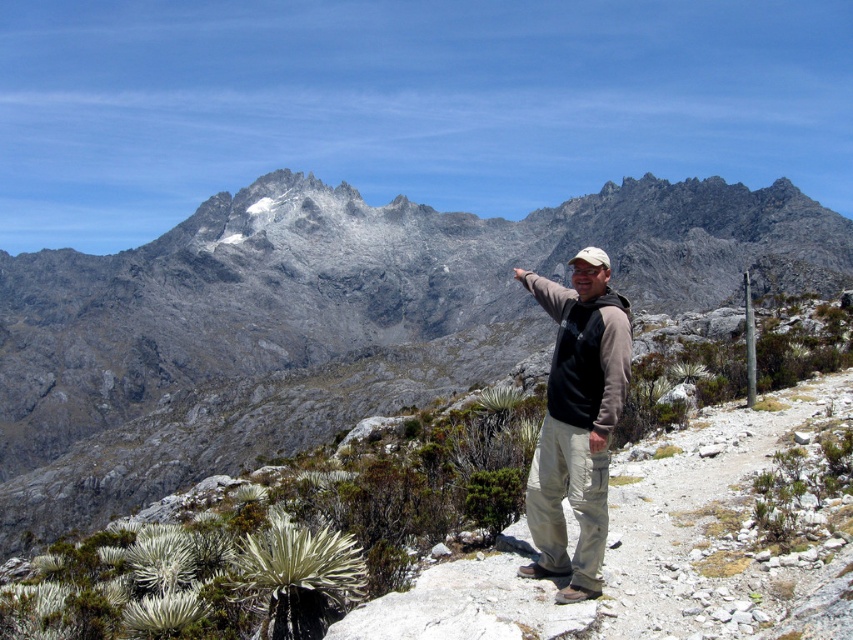
Is point (746, 513) positioned in front of point (584, 452)?

No.

Between point (840, 518) and point (556, 344), which one is positioned behind?

Point (556, 344)

Is point (750, 445) closer to camera compared to point (577, 467)?

That is False.

Image resolution: width=853 pixels, height=640 pixels. I want to click on smooth dirt path at center, so click(x=662, y=545).

Does gray rocky mountain at center have a greater width compared to brown cotton shirt at center?

Yes, gray rocky mountain at center is wider than brown cotton shirt at center.

Does point (695, 214) come closer to viewer compared to point (547, 506)?

No, (695, 214) is behind (547, 506).

What are the coordinates of `gray rocky mountain at center` in the screenshot? It's located at (337, 323).

Is point (799, 260) positioned behind point (675, 608)?

Yes.

Where is `gray rocky mountain at center`? gray rocky mountain at center is located at coordinates (337, 323).

Is point (508, 282) positioned behind point (563, 609)?

Yes, point (508, 282) is behind point (563, 609).

You are a GUI agent. You are given a task and a screenshot of the screen. Output one action in this format:
    pyautogui.click(x=<x>, y=<y>)
    Task: Click on the gray rocky mountain at center
    Image resolution: width=853 pixels, height=640 pixels.
    Given the screenshot: What is the action you would take?
    pyautogui.click(x=337, y=323)